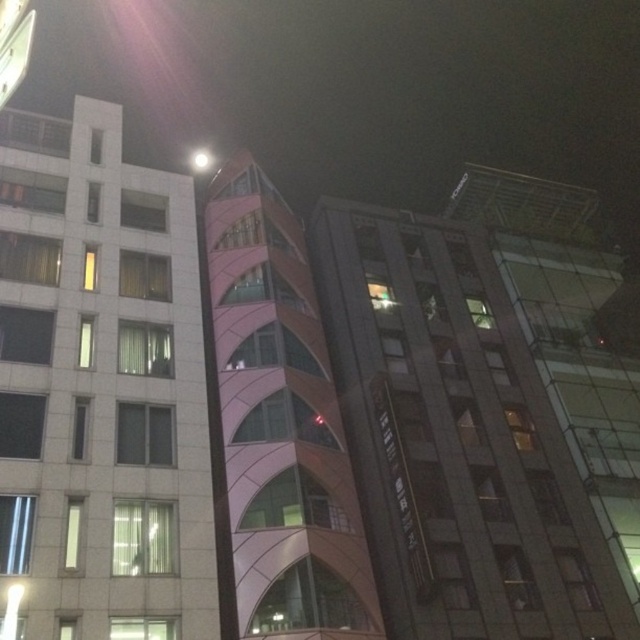
Does pink glass building at center have a greater height compared to white glossy building at left?

No, pink glass building at center is not taller than white glossy building at left.

Is pink glass building at center bigger than white glossy building at left?

Yes.

Find the location of `pink glass building at center`. pink glass building at center is located at coordinates (480, 424).

Is the position of white glossy building at left more distant than that of pink glass tower at center?

No, white glossy building at left is closer to the viewer.

Does white glossy building at left appear on the left side of pink glass tower at center?

Indeed, white glossy building at left is positioned on the left side of pink glass tower at center.

At what (x,y) coordinates should I click in order to perform the action: click on white glossy building at left. Please return your answer as a coordinate pair (x, y). Image resolution: width=640 pixels, height=640 pixels. Looking at the image, I should click on (104, 392).

How far apart are pink glass building at center and pink glass tower at center?

10.55 meters

Which is below, pink glass building at center or pink glass tower at center?

Positioned lower is pink glass building at center.

Measure the distance between point (400,285) and camera.

Point (400,285) is 49.93 meters from camera.

Image resolution: width=640 pixels, height=640 pixels. Find the location of `pink glass building at center`. pink glass building at center is located at coordinates (480, 424).